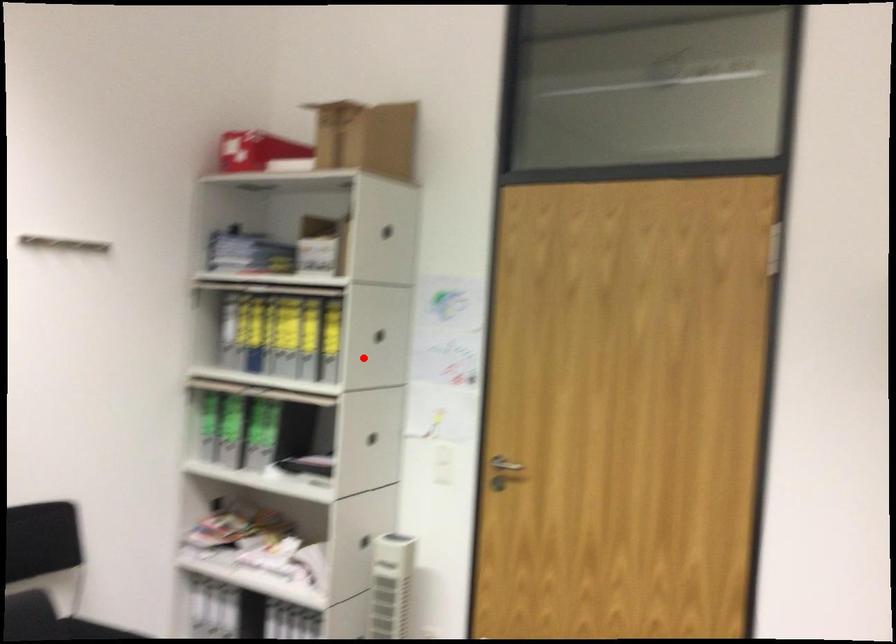
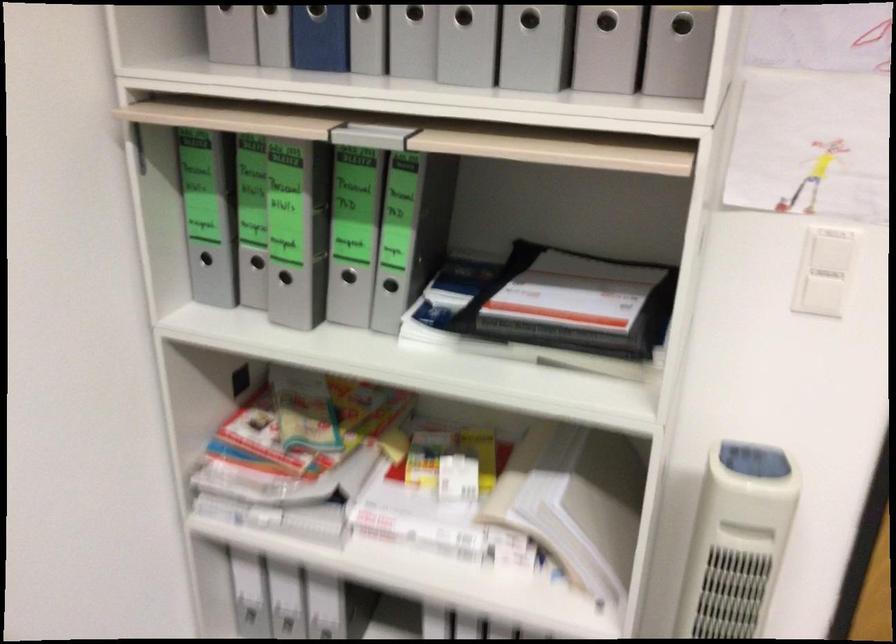
Locate, in the second image, the point that corresponds to the highlighted location in the first image.

(682, 24)